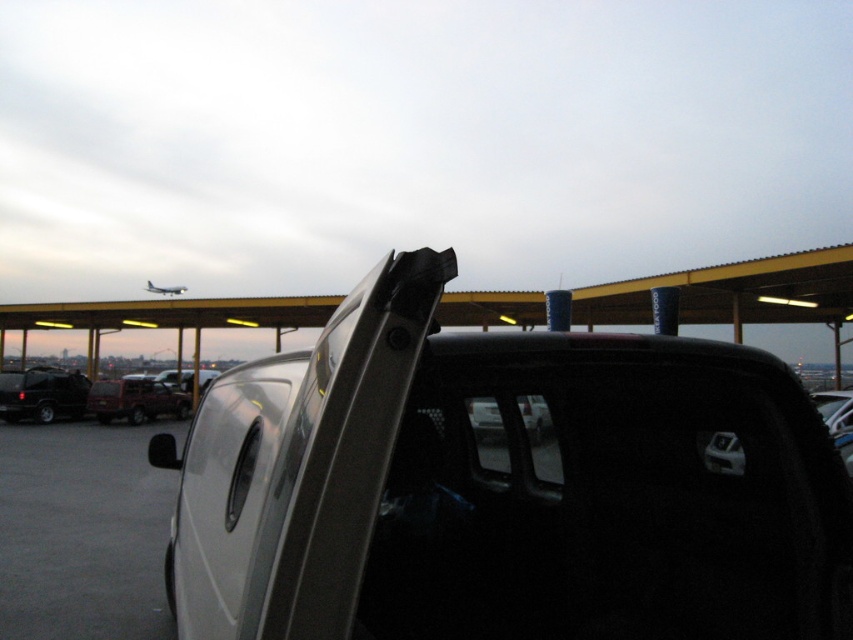
You are standing at the camera position and want to walk to the point marked at coordinates (109,387). How far will you have to walk to reach that point?

The point marked at coordinates (109,387) is 25.51 meters away from the camera, so you will have to walk 25.51 meters to reach it.

You are a parking attendant who needs to fit a new car into the parking spot between the satin silver pickup at center and the matte red pickup truck at center. Given that the new car is 1.8 meters wide, can you determine if there is enough space between them to accommodate it?

The satin silver pickup at center is wider than the matte red pickup truck at center. However, without knowing the exact width of either pickup or the distance between them, it is impossible to determine if the 1.8 meter wide car will fit in the space between them.

You are standing at the parking lot and want to locate two points marked in the image. Which point is closer to you, point (140, 396) or point (523, 419)?

Point (140, 396) is further to the camera than point (523, 419), so point (523, 419) is closer to you.